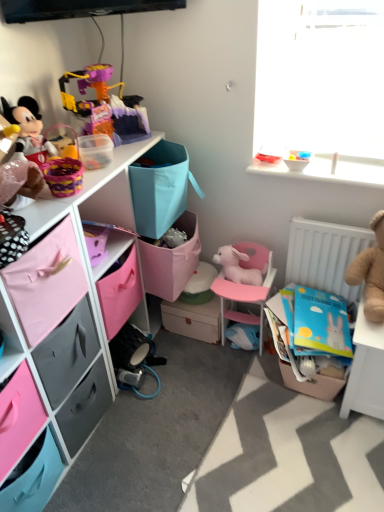
Question: Can you confirm if pink fabric drawer at lower left, positioned as the second drawer in back-to-front order, is bigger than matte black plush toy at left, which ranks as the 1th toy in left-to-right order?

Choices:
 (A) no
 (B) yes

Answer: (B)

Question: Are pink fabric drawer at lower left, positioned as the second drawer in back-to-front order, and matte black plush toy at left, which is counted as the seventh toy, starting from the right, making contact?

Choices:
 (A) yes
 (B) no

Answer: (B)

Question: Does pink fabric drawer at lower left, positioned as the second drawer in back-to-front order, have a greater height compared to matte black plush toy at left, which ranks as the 1th toy in left-to-right order?

Choices:
 (A) no
 (B) yes

Answer: (B)

Question: Is pink fabric drawer at lower left, which is the first drawer in front-to-back order, positioned before matte black plush toy at left, which ranks as the 1th toy in left-to-right order?

Choices:
 (A) yes
 (B) no

Answer: (A)

Question: Considering the relative sizes of pink fabric drawer at lower left, which is the first drawer in front-to-back order, and matte black plush toy at left, which ranks as the 1th toy in left-to-right order, in the image provided, is pink fabric drawer at lower left, which is the first drawer in front-to-back order, shorter than matte black plush toy at left, which ranks as the 1th toy in left-to-right order,?

Choices:
 (A) yes
 (B) no

Answer: (B)

Question: Is pink plush rabbit at center, which is the 3th toy in left-to-right order, taller or shorter than pink plastic chair at center?

Choices:
 (A) tall
 (B) short

Answer: (B)

Question: Considering their positions, is pink plush rabbit at center, which is the 5th toy in right-to-left order, located in front of or behind pink plastic chair at center?

Choices:
 (A) behind
 (B) front

Answer: (A)

Question: Based on their positions, is pink plush rabbit at center, which is the 5th toy in right-to-left order, located to the left or right of pink plastic chair at center?

Choices:
 (A) left
 (B) right

Answer: (A)

Question: Considering the positions of point (220, 261) and point (223, 332), is point (220, 261) closer or farther from the camera than point (223, 332)?

Choices:
 (A) farther
 (B) closer

Answer: (B)

Question: Considering the positions of pink plush rabbit at center, which is the 3th toy in left-to-right order, and matte black plush toy at left, which ranks as the 1th toy in left-to-right order, in the image, is pink plush rabbit at center, which is the 3th toy in left-to-right order, taller or shorter than matte black plush toy at left, which ranks as the 1th toy in left-to-right order,?

Choices:
 (A) tall
 (B) short

Answer: (B)

Question: Is pink plush rabbit at center, which is the 5th toy in right-to-left order, to the left or to the right of matte black plush toy at left, which is counted as the seventh toy, starting from the right, in the image?

Choices:
 (A) right
 (B) left

Answer: (A)

Question: Considering the positions of pink plush rabbit at center, which is the 5th toy in right-to-left order, and matte black plush toy at left, which ranks as the 1th toy in left-to-right order, in the image, is pink plush rabbit at center, which is the 5th toy in right-to-left order, bigger or smaller than matte black plush toy at left, which ranks as the 1th toy in left-to-right order,?

Choices:
 (A) small
 (B) big

Answer: (A)

Question: Is pink plush rabbit at center, which is the 3th toy in left-to-right order, situated inside matte black plush toy at left, which is counted as the seventh toy, starting from the right, or outside?

Choices:
 (A) inside
 (B) outside

Answer: (B)

Question: From a real-world perspective, is pink plastic chair at center above or below plastic toy at upper left, placed as the sixth toy when sorted from right to left?

Choices:
 (A) above
 (B) below

Answer: (B)

Question: Is pink plastic chair at center wider or thinner than plastic toy at upper left, placed as the sixth toy when sorted from right to left?

Choices:
 (A) thin
 (B) wide

Answer: (B)